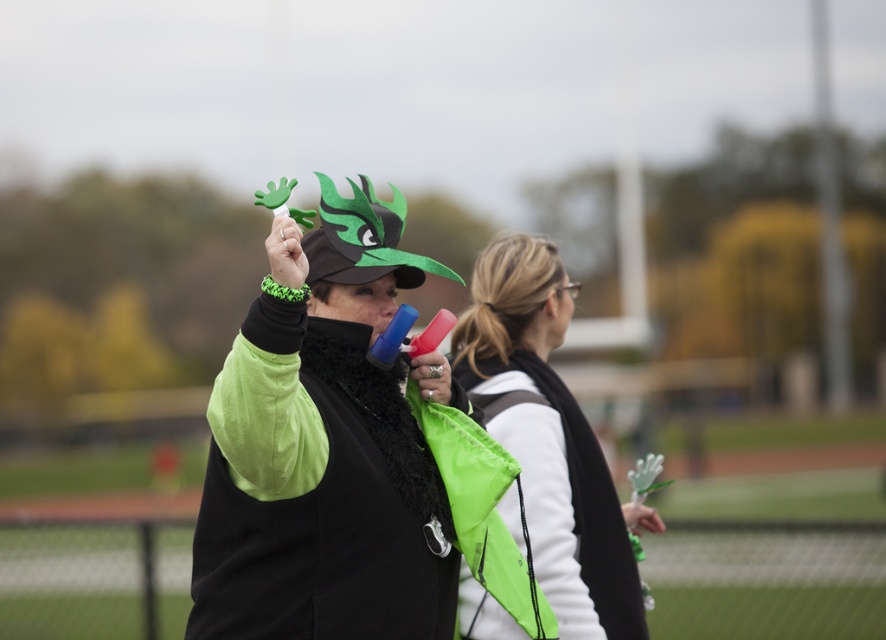
Is matte green plastic hand at center further to the viewer compared to neon green jacket at center?

No, matte green plastic hand at center is closer to the viewer.

Which of these two, matte green plastic hand at center or neon green jacket at center, stands shorter?

With less height is matte green plastic hand at center.

Is point (370, 604) positioned after point (548, 326)?

No, it is in front of (548, 326).

The height and width of the screenshot is (640, 886). What are the coordinates of `matte green plastic hand at center` in the screenshot? It's located at (327, 464).